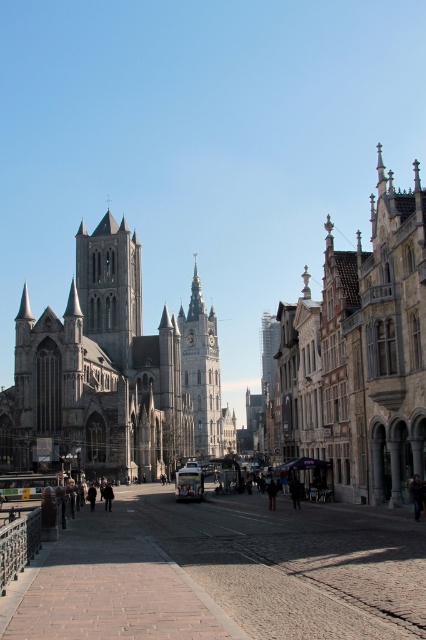
You are standing in the middle of the street looking at the historic buildings. There are two points marked on the ground in front of you. One is at point coordinates point (109,227) and the other is at point (109,483). Which point is closer to you?

Point (109,227) is closer to you because it is further to the viewer than point (109,483).

You are standing at the point with coordinates 0.5, 0.25. Where is the gray stone tower at center relative to your position?

The gray stone tower at center is located to the left of your position at coordinates (106, 320) since it is at point (109, 285).

In the scene shown: You are standing in the urban scene and want to determine the relative positions of two points marked in the image. Which point, point (406, 362) or point (215, 428), is closer to you?

Point (406, 362) is closer to the viewer than point (215, 428).